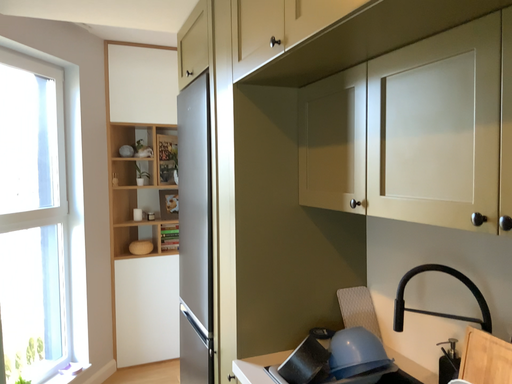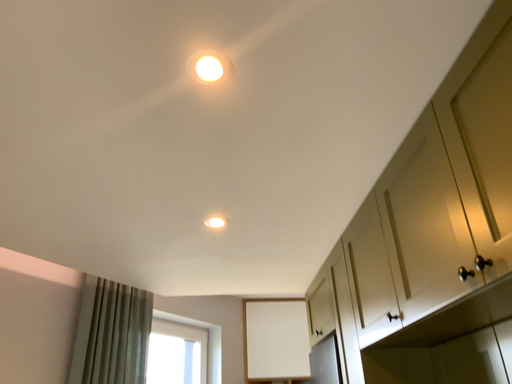
Question: Which way did the camera rotate in the video?

Choices:
 (A) rotated upward
 (B) rotated downward

Answer: (A)